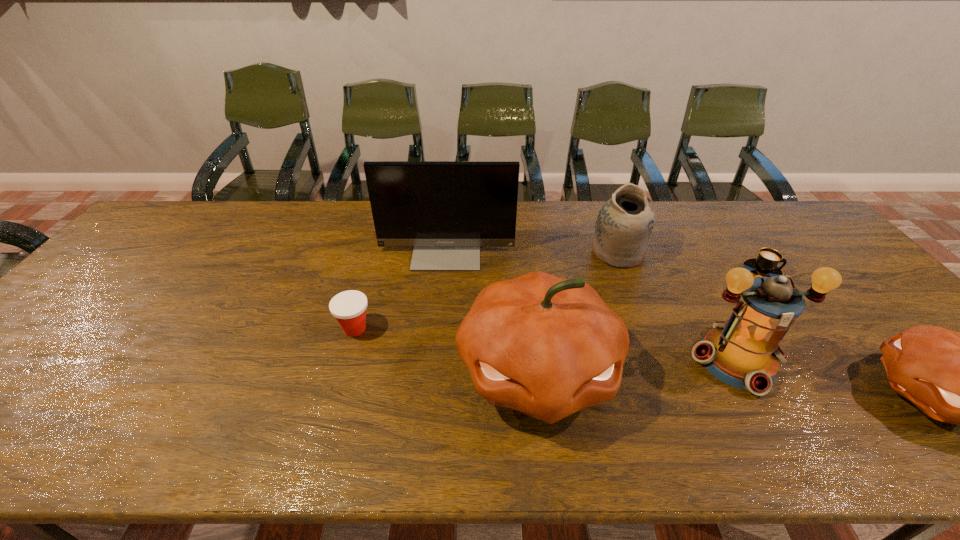
Identify the location of computer monitor present at the far edge. tap(446, 210).

Identify the location of pottery that is at the far edge. (624, 225).

Image resolution: width=960 pixels, height=540 pixels. In order to click on pumpkin located in the near edge section of the desktop in this screenshot , I will do `click(548, 347)`.

Where is `lantern that is positioned at the near edge`? Image resolution: width=960 pixels, height=540 pixels. lantern that is positioned at the near edge is located at coordinates (743, 352).

Locate an element on the screen. free space at the far edge of the desktop is located at coordinates (318, 228).

Image resolution: width=960 pixels, height=540 pixels. In the image, there is a desktop. What are the coordinates of `vacant space at the near edge` in the screenshot? It's located at (412, 382).

This screenshot has height=540, width=960. In the image, there is a desktop. Find the location of `vacant space at the right edge`. vacant space at the right edge is located at coordinates tap(847, 265).

This screenshot has height=540, width=960. I want to click on blank space at the far left corner of the desktop, so click(x=207, y=206).

I want to click on free space at the near left corner of the desktop, so click(31, 410).

The width and height of the screenshot is (960, 540). Find the location of `vacant space that is in between the pottery and the shortest object`. vacant space that is in between the pottery and the shortest object is located at coordinates (690, 262).